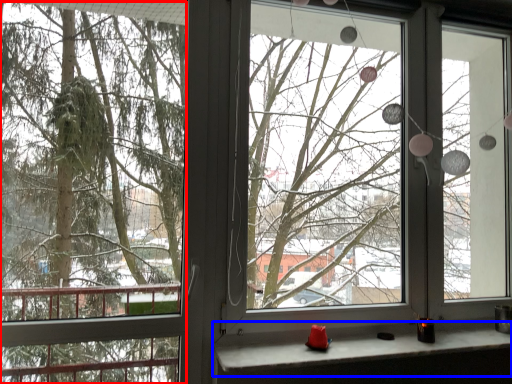
Question: Among these objects, which one is farthest to the camera, tree (highlighted by a red box) or window sill (highlighted by a blue box)?

Choices:
 (A) tree
 (B) window sill

Answer: (B)